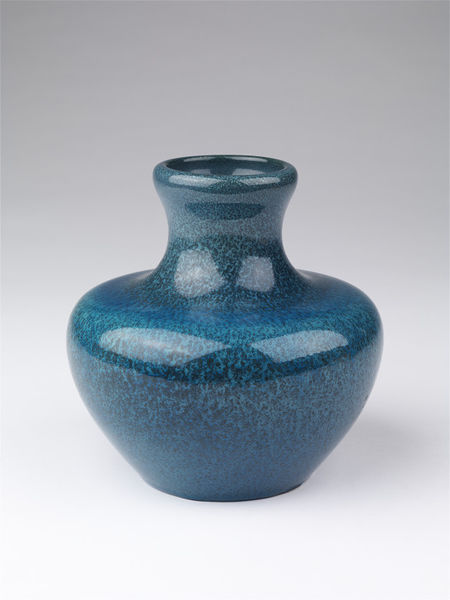
The height and width of the screenshot is (600, 450). I want to click on pot shadow, so click(x=360, y=448).